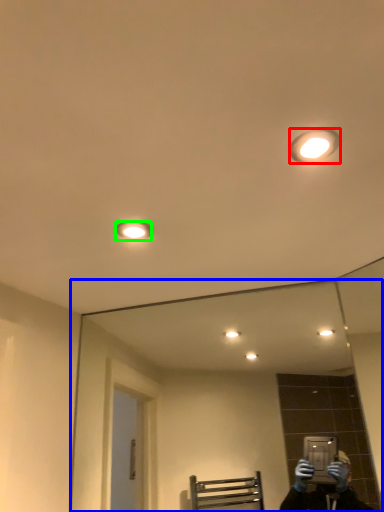
Question: Which object is positioned farthest from light fixture (highlighted by a red box)? Select from mirror (highlighted by a blue box) and light fixture (highlighted by a green box).

Choices:
 (A) mirror
 (B) light fixture

Answer: (A)